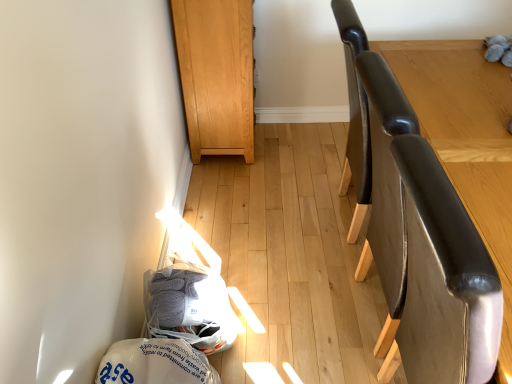
What do you see at coordinates (416, 233) in the screenshot?
I see `glossy leather chair at right` at bounding box center [416, 233].

In order to face glossy leather chair at right, should I rotate leftwards or rightwards?

You should rotate right by 31.030 degrees.

The height and width of the screenshot is (384, 512). Describe the element at coordinates (190, 307) in the screenshot. I see `gray yarn at lower left, which is counted as the 2th material, starting from the bottom` at that location.

What is the approximate width of white plastic bag at lower left, marked as the second material in a top-to-bottom arrangement?

white plastic bag at lower left, marked as the second material in a top-to-bottom arrangement, is 13.46 inches in width.

You are a GUI agent. You are given a task and a screenshot of the screen. Output one action in this format:
    pyautogui.click(x=<x>, y=<y>)
    Task: Click on the light brown wood cabinet at upper center
    The height and width of the screenshot is (384, 512).
    Given the screenshot: What is the action you would take?
    pyautogui.click(x=216, y=75)

I want to click on glossy leather chair at right, so click(x=416, y=233).

Is glossy leather chair at right far away from leather-like brown swivel chair at right?

Actually, glossy leather chair at right and leather-like brown swivel chair at right are a little close together.

Is glossy leather chair at right positioned with its back to leather-like brown swivel chair at right?

Yes, glossy leather chair at right is positioned with its back facing leather-like brown swivel chair at right.

Between glossy leather chair at right and leather-like brown swivel chair at right, which one appears on the right side from the viewer's perspective?

Positioned to the right is glossy leather chair at right.

Considering the relative sizes of glossy leather chair at right and leather-like brown swivel chair at right in the image provided, is glossy leather chair at right taller than leather-like brown swivel chair at right?

No, glossy leather chair at right is not taller than leather-like brown swivel chair at right.

Considering the sizes of objects leather-like brown swivel chair at right and gray yarn at lower left, which is the 1th material from top to bottom, in the image provided, who is wider, leather-like brown swivel chair at right or gray yarn at lower left, which is the 1th material from top to bottom,?

Wider between the two is leather-like brown swivel chair at right.

Considering the relative sizes of leather-like brown swivel chair at right and gray yarn at lower left, which is counted as the 2th material, starting from the bottom, in the image provided, is leather-like brown swivel chair at right smaller than gray yarn at lower left, which is counted as the 2th material, starting from the bottom,?

Actually, leather-like brown swivel chair at right might be larger than gray yarn at lower left, which is counted as the 2th material, starting from the bottom.

From the image's perspective, who appears lower, gray yarn at lower left, which is the 1th material from top to bottom, or glossy leather chair at right?

gray yarn at lower left, which is the 1th material from top to bottom, is shown below in the image.

Which of these two, gray yarn at lower left, which is counted as the 2th material, starting from the bottom, or glossy leather chair at right, is bigger?

glossy leather chair at right is bigger.

This screenshot has height=384, width=512. In order to click on the 1st material located beneath the glossy leather chair at right (from a real-world perspective) in this screenshot , I will do `click(190, 307)`.

Looking at this image, from the image's perspective, would you say light brown wood cabinet at upper center is shown under leather-like brown swivel chair at right?

No, from the image's perspective, light brown wood cabinet at upper center is not below leather-like brown swivel chair at right.

Looking at their sizes, would you say light brown wood cabinet at upper center is wider or thinner than leather-like brown swivel chair at right?

Clearly, light brown wood cabinet at upper center has less width compared to leather-like brown swivel chair at right.

Is the depth of light brown wood cabinet at upper center less than that of leather-like brown swivel chair at right?

No, light brown wood cabinet at upper center is further to the viewer.

The image size is (512, 384). What are the coordinates of `swivel chair below the light brown wood cabinet at upper center (from the image's perspective)` in the screenshot? It's located at (444, 278).

From the image's perspective, is glossy leather chair at right above or below white plastic bag at lower left, marked as the second material in a top-to-bottom arrangement?

glossy leather chair at right is above white plastic bag at lower left, marked as the second material in a top-to-bottom arrangement.

From a real-world perspective, which is physically below, glossy leather chair at right or white plastic bag at lower left, marked as the second material in a top-to-bottom arrangement?

white plastic bag at lower left, marked as the second material in a top-to-bottom arrangement, from a real-world perspective.

Between glossy leather chair at right and white plastic bag at lower left, marked as the second material in a top-to-bottom arrangement, which one is positioned behind?

white plastic bag at lower left, marked as the second material in a top-to-bottom arrangement, is further from the camera.

How far apart are glossy leather chair at right and white plastic bag at lower left, which appears as the 1th material when ordered from the bottom?

A distance of 29.23 inches exists between glossy leather chair at right and white plastic bag at lower left, which appears as the 1th material when ordered from the bottom.

Considering the relative sizes of light brown wood cabinet at upper center and gray yarn at lower left, which is the 1th material from top to bottom, in the image provided, is light brown wood cabinet at upper center bigger than gray yarn at lower left, which is the 1th material from top to bottom,?

Yes.

Is point (206, 55) farther from viewer compared to point (170, 279)?

Yes, it is.

Which of these two, light brown wood cabinet at upper center or gray yarn at lower left, which is counted as the 2th material, starting from the bottom, is wider?

Wider between the two is light brown wood cabinet at upper center.

Can you tell me how much glossy leather chair at right and gray yarn at lower left, which is the 1th material from top to bottom, differ in facing direction?

glossy leather chair at right and gray yarn at lower left, which is the 1th material from top to bottom, are facing 0.0169 degrees away from each other.

Considering the sizes of glossy leather chair at right and gray yarn at lower left, which is the 1th material from top to bottom, in the image, is glossy leather chair at right bigger or smaller than gray yarn at lower left, which is the 1th material from top to bottom,?

In the image, glossy leather chair at right appears to be larger than gray yarn at lower left, which is the 1th material from top to bottom.

Is glossy leather chair at right not inside gray yarn at lower left, which is counted as the 2th material, starting from the bottom?

glossy leather chair at right is positioned outside gray yarn at lower left, which is counted as the 2th material, starting from the bottom.

Is glossy leather chair at right facing towards gray yarn at lower left, which is counted as the 2th material, starting from the bottom?

No, glossy leather chair at right does not turn towards gray yarn at lower left, which is counted as the 2th material, starting from the bottom.

What are the coordinates of `chair behind the leather-like brown swivel chair at right` in the screenshot? It's located at (416, 233).

This screenshot has width=512, height=384. I want to click on the 1st material below when counting from the leather-like brown swivel chair at right (from the image's perspective), so click(x=190, y=307).

Which object lies nearer to the anchor point leather-like brown swivel chair at right, white plastic bag at lower left, marked as the second material in a top-to-bottom arrangement, or gray yarn at lower left, which is the 1th material from top to bottom?

The object closer to leather-like brown swivel chair at right is white plastic bag at lower left, marked as the second material in a top-to-bottom arrangement.

Which object lies further to the anchor point glossy leather chair at right, white plastic bag at lower left, which appears as the 1th material when ordered from the bottom, or light brown wood cabinet at upper center?

light brown wood cabinet at upper center lies further to glossy leather chair at right than the other object.

Looking at the image, which one is located further to gray yarn at lower left, which is counted as the 2th material, starting from the bottom, white plastic bag at lower left, marked as the second material in a top-to-bottom arrangement, or glossy leather chair at right?

glossy leather chair at right is positioned further to the anchor gray yarn at lower left, which is counted as the 2th material, starting from the bottom.

Based on their spatial positions, is gray yarn at lower left, which is the 1th material from top to bottom, or leather-like brown swivel chair at right further from light brown wood cabinet at upper center?

leather-like brown swivel chair at right is further to light brown wood cabinet at upper center.

When comparing their distances from white plastic bag at lower left, which appears as the 1th material when ordered from the bottom, does leather-like brown swivel chair at right or gray yarn at lower left, which is counted as the 2th material, starting from the bottom, seem further?

leather-like brown swivel chair at right is positioned further to the anchor white plastic bag at lower left, which appears as the 1th material when ordered from the bottom.

From the image, which object appears to be nearer to leather-like brown swivel chair at right, light brown wood cabinet at upper center or gray yarn at lower left, which is the 1th material from top to bottom?

Answer: gray yarn at lower left, which is the 1th material from top to bottom, is positioned closer to the anchor leather-like brown swivel chair at right.

Considering their positions, is leather-like brown swivel chair at right positioned closer to gray yarn at lower left, which is the 1th material from top to bottom, than white plastic bag at lower left, marked as the second material in a top-to-bottom arrangement?

Among the two, white plastic bag at lower left, marked as the second material in a top-to-bottom arrangement, is located nearer to gray yarn at lower left, which is the 1th material from top to bottom.

Considering their positions, is leather-like brown swivel chair at right positioned further to white plastic bag at lower left, which appears as the 1th material when ordered from the bottom, than glossy leather chair at right?

glossy leather chair at right.

You are a GUI agent. You are given a task and a screenshot of the screen. Output one action in this format:
    pyautogui.click(x=<x>, y=<y>)
    Task: Click on the swivel chair located between gray yarn at lower left, which is counted as the 2th material, starting from the bottom, and glossy leather chair at right in the left-right direction
    The width and height of the screenshot is (512, 384).
    Given the screenshot: What is the action you would take?
    pyautogui.click(x=444, y=278)

In order to click on material situated between white plastic bag at lower left, which appears as the 1th material when ordered from the bottom, and glossy leather chair at right from left to right in this screenshot , I will do (190, 307).

The width and height of the screenshot is (512, 384). What are the coordinates of `furniture between gray yarn at lower left, which is the 1th material from top to bottom, and glossy leather chair at right, in the horizontal direction` in the screenshot? It's located at (216, 75).

Locate an element on the screen. material located between white plastic bag at lower left, marked as the second material in a top-to-bottom arrangement, and leather-like brown swivel chair at right in the left-right direction is located at coordinates (190, 307).